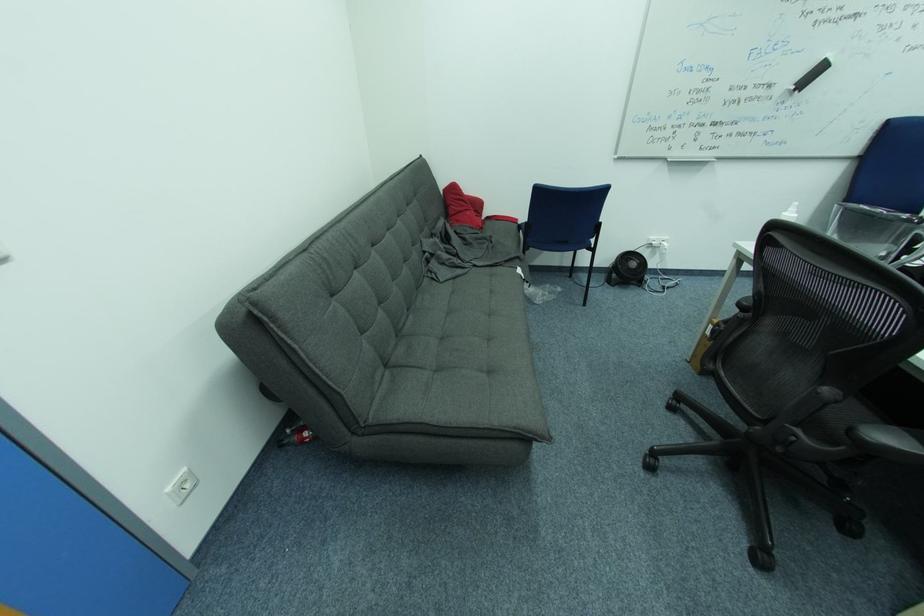
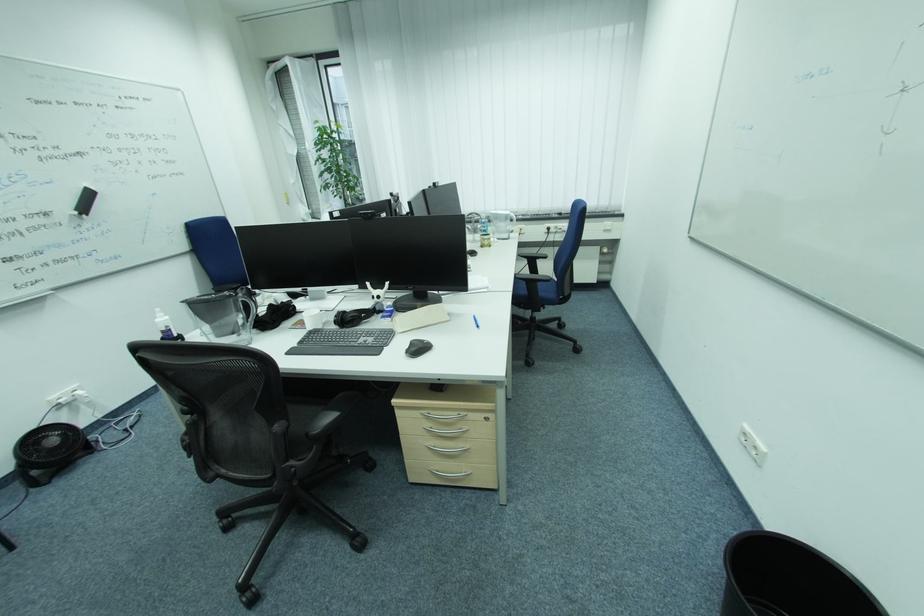
The images are taken continuously from a first-person perspective. In which direction is your viewpoint rotating?

The camera rotated toward right-down.